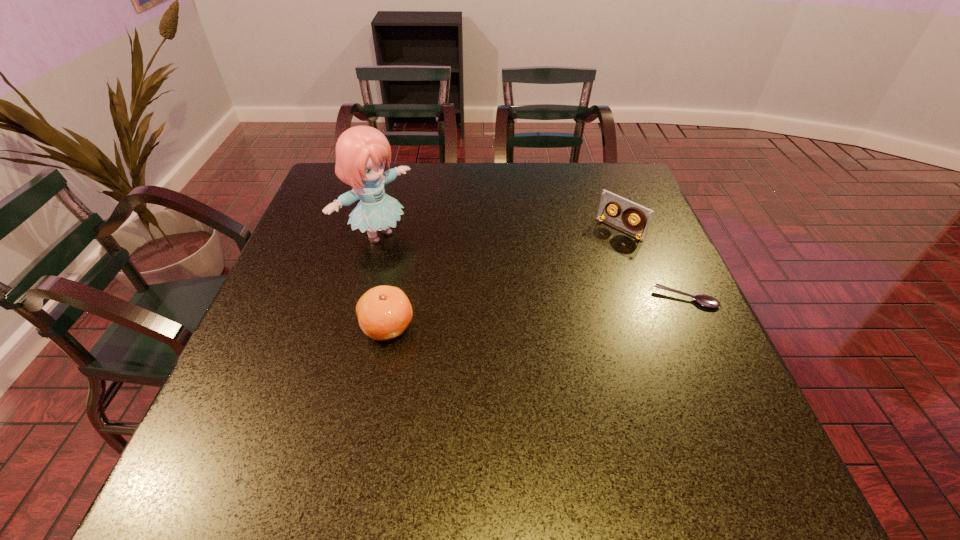
Where is `clementine`? Image resolution: width=960 pixels, height=540 pixels. clementine is located at coordinates (384, 312).

Identify the location of the shortest object. Image resolution: width=960 pixels, height=540 pixels. (705, 300).

I want to click on doll, so tap(361, 152).

Identify the location of videotape. The width and height of the screenshot is (960, 540). (643, 215).

Where is `vacant region located on the right of the clementine`? Image resolution: width=960 pixels, height=540 pixels. vacant region located on the right of the clementine is located at coordinates (447, 327).

Where is `vacant space situated on the back of the shortest object`? Image resolution: width=960 pixels, height=540 pixels. vacant space situated on the back of the shortest object is located at coordinates (667, 257).

Where is `free space located 0.240m on the front-facing side of the doll`? This screenshot has width=960, height=540. free space located 0.240m on the front-facing side of the doll is located at coordinates (473, 294).

At what (x,y) coordinates should I click in order to perform the action: click on vacant space located on the front-facing side of the doll. Please return your answer as a coordinate pair (x, y). Looking at the image, I should click on (420, 263).

Locate an element on the screen. This screenshot has width=960, height=540. vacant space located 0.180m on the front-facing side of the doll is located at coordinates (454, 282).

At what (x,y) coordinates should I click in order to perform the action: click on free space located 0.360m at the front of the videotape with visible reels. Please return your answer as a coordinate pair (x, y). Looking at the image, I should click on (521, 313).